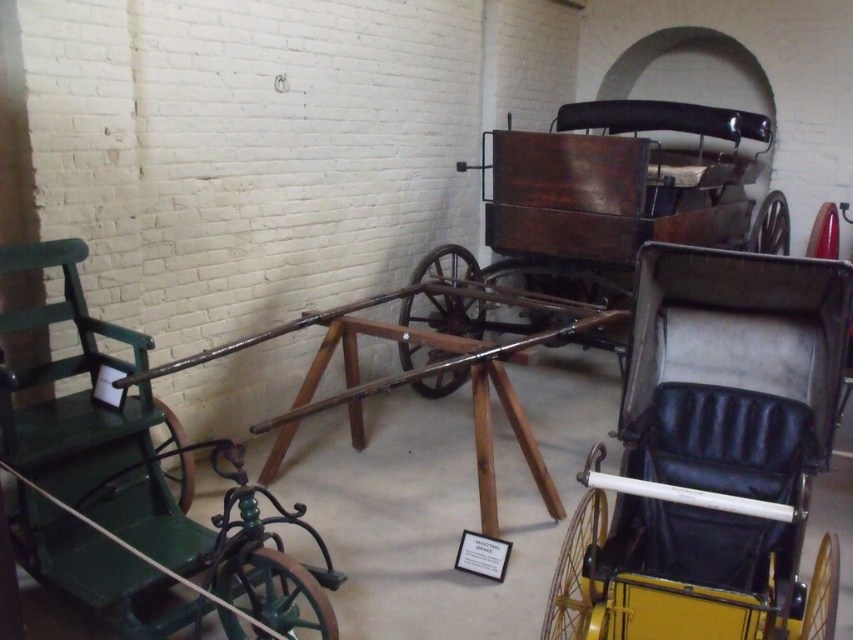
Question: Can you confirm if yellow leather chair at center is positioned to the right of green wrought iron chair at left?

Choices:
 (A) no
 (B) yes

Answer: (B)

Question: Among these points, which one is nearest to the camera?

Choices:
 (A) (614, 632)
 (B) (178, 525)

Answer: (A)

Question: Can you confirm if yellow leather chair at center is positioned above green wrought iron chair at left?

Choices:
 (A) no
 (B) yes

Answer: (B)

Question: Can you confirm if yellow leather chair at center is wider than green wrought iron chair at left?

Choices:
 (A) yes
 (B) no

Answer: (B)